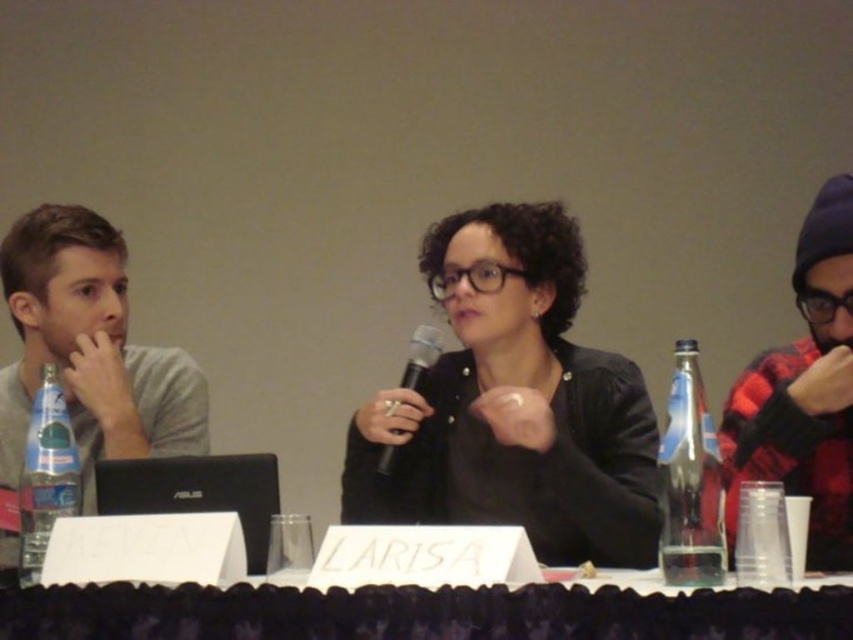
Measure the distance from clear glass bottle at center to black matte microphone at center.

clear glass bottle at center and black matte microphone at center are 21.86 inches apart.

Is clear glass bottle at center to the left of black matte microphone at center from the viewer's perspective?

In fact, clear glass bottle at center is to the right of black matte microphone at center.

What do you see at coordinates (689, 481) in the screenshot?
I see `clear glass bottle at center` at bounding box center [689, 481].

Locate an element on the screen. clear glass bottle at center is located at coordinates (689, 481).

Can you confirm if white plastic table at center is taller than gray matte shirt at left?

No.

Who is positioned more to the left, white plastic table at center or gray matte shirt at left?

From the viewer's perspective, gray matte shirt at left appears more on the left side.

Who is more distant from viewer, (809, 609) or (201, 416)?

The point (201, 416) is behind.

Locate an element on the screen. The height and width of the screenshot is (640, 853). white plastic table at center is located at coordinates (421, 612).

Does red plaid shirt at right appear over clear plastic bottle at left?

Yes.

Who is higher up, red plaid shirt at right or clear plastic bottle at left?

red plaid shirt at right

Does point (723, 456) come behind point (36, 404)?

Yes, point (723, 456) is behind point (36, 404).

Find the location of a particular element. The image size is (853, 640). red plaid shirt at right is located at coordinates (804, 392).